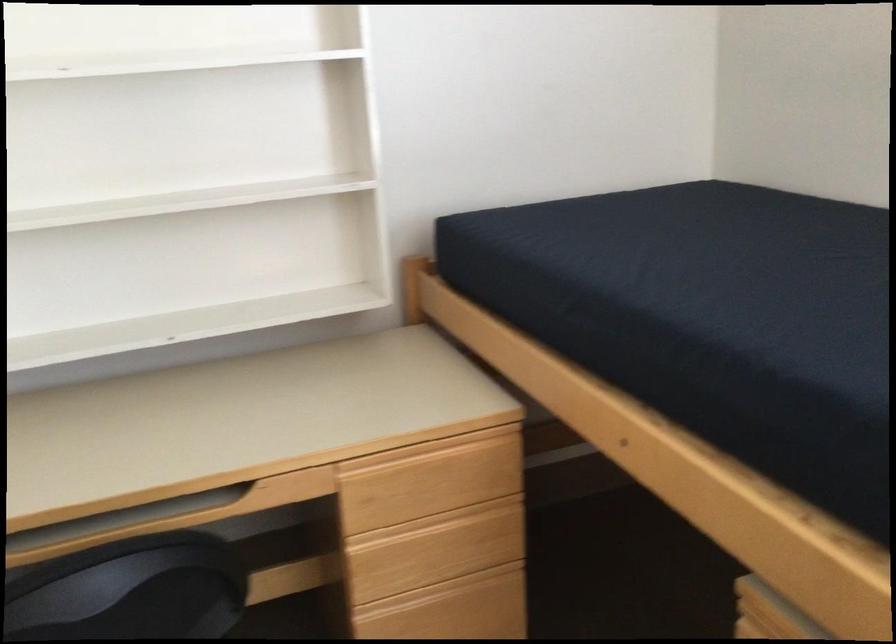
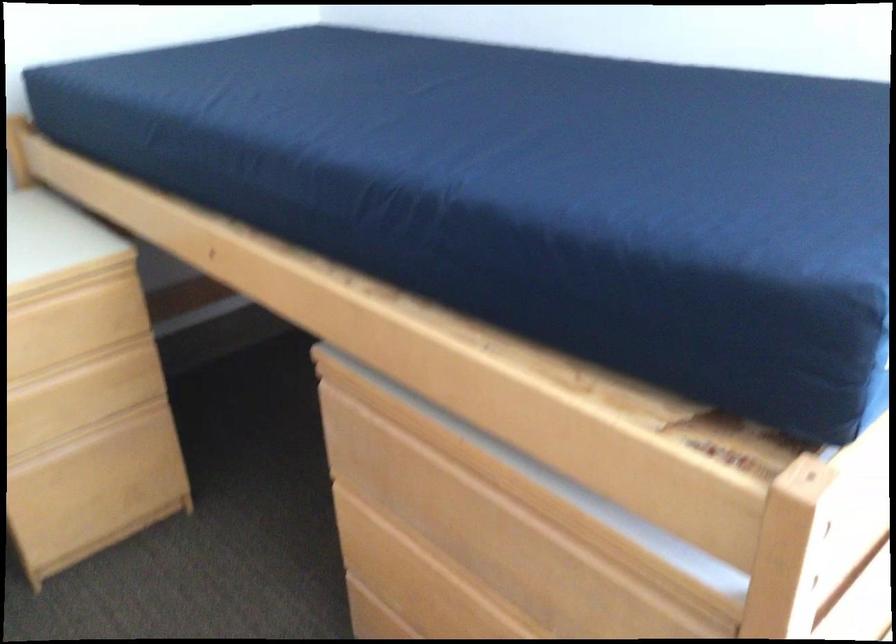
Which direction would the cameraman need to move to produce the second image?

The cameraman moved toward right, backward.